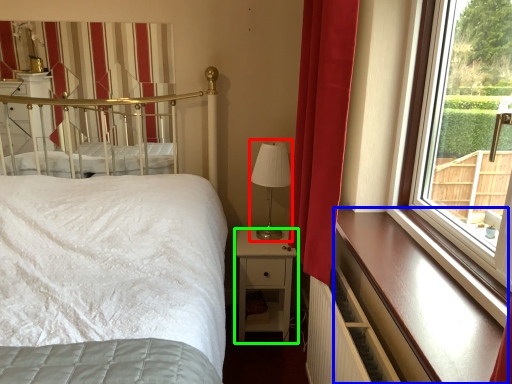
Question: Based on their relative distances, which object is nearer to table lamp (highlighted by a red box)? Choose from ledge (highlighted by a blue box) and nightstand (highlighted by a green box).

Choices:
 (A) ledge
 (B) nightstand

Answer: (B)